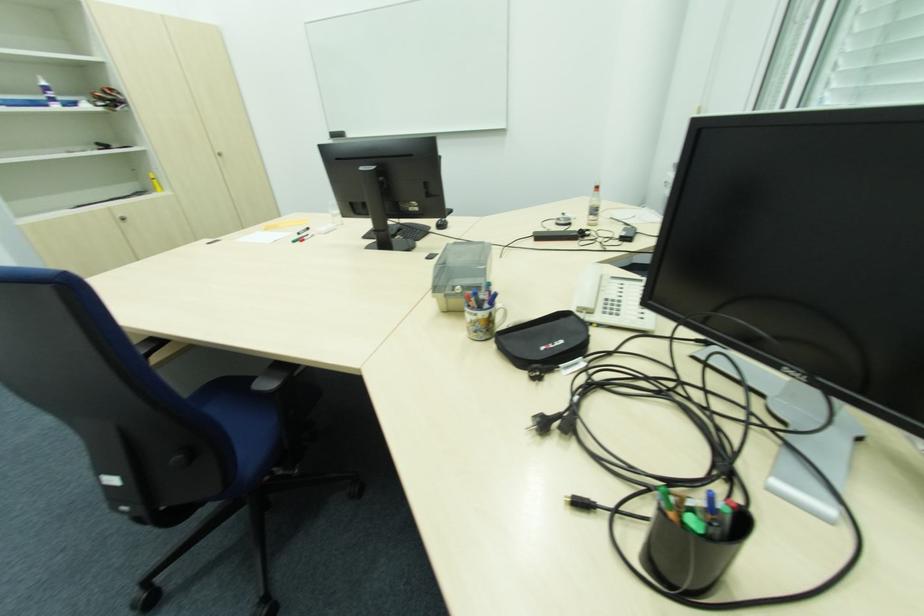
Locate an element on the screen. This screenshot has height=616, width=924. pen holder is located at coordinates (694, 543).